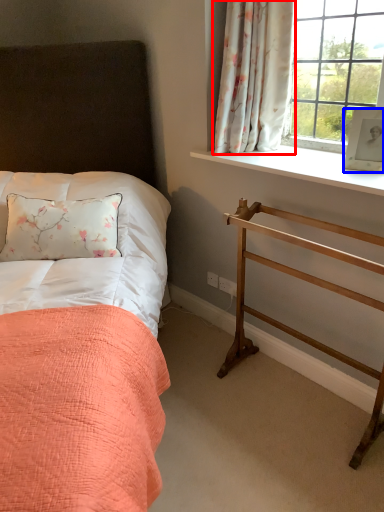
Question: Which object appears farthest to the camera in this image, curtain (highlighted by a red box) or picture frame (highlighted by a blue box)?

Choices:
 (A) curtain
 (B) picture frame

Answer: (A)